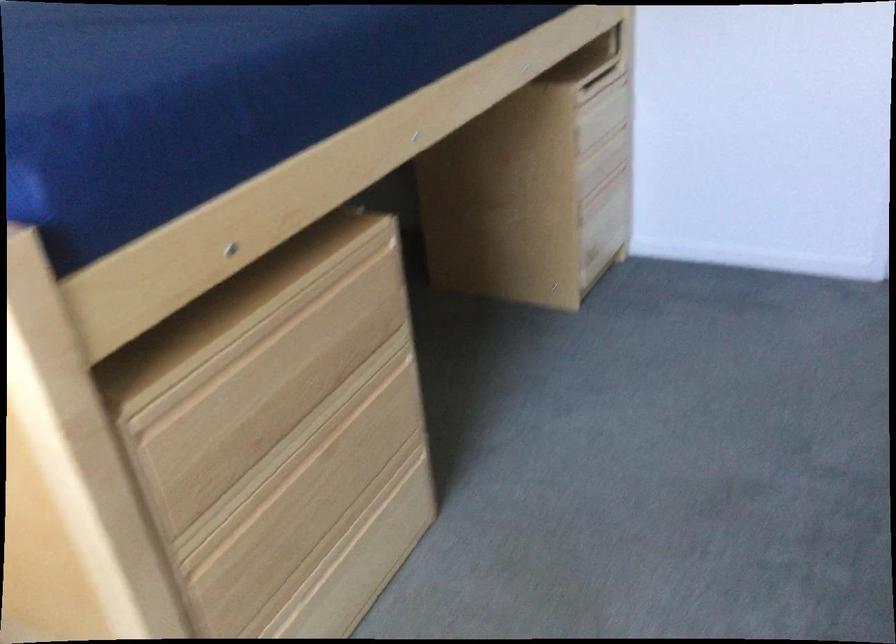
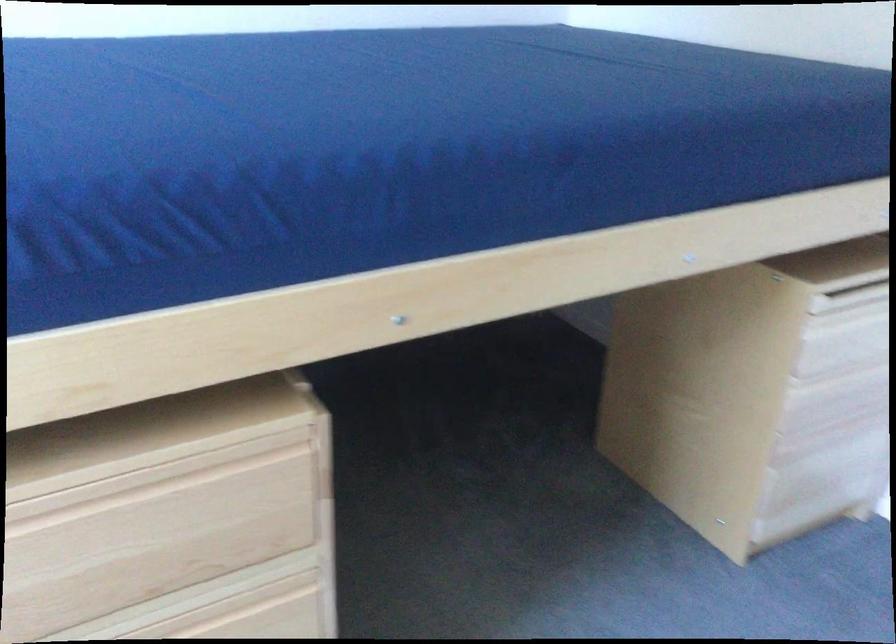
In the second image, find the point that corresponds to [326,303] in the first image.

(174, 494)